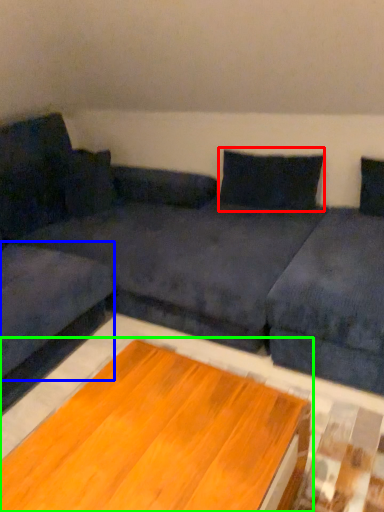
Question: Which object is the farthest from pillow (highlighted by a red box)? Choose among these: couch (highlighted by a blue box) or table (highlighted by a green box).

Choices:
 (A) couch
 (B) table

Answer: (B)